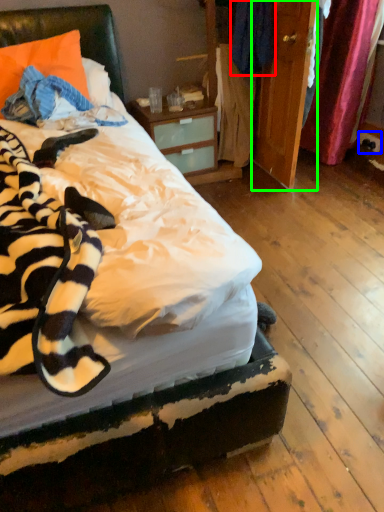
Question: Which is nearer to the clothing (highlighted by a red box)? power outlet (highlighted by a blue box) or armoire (highlighted by a green box).

Choices:
 (A) power outlet
 (B) armoire

Answer: (B)